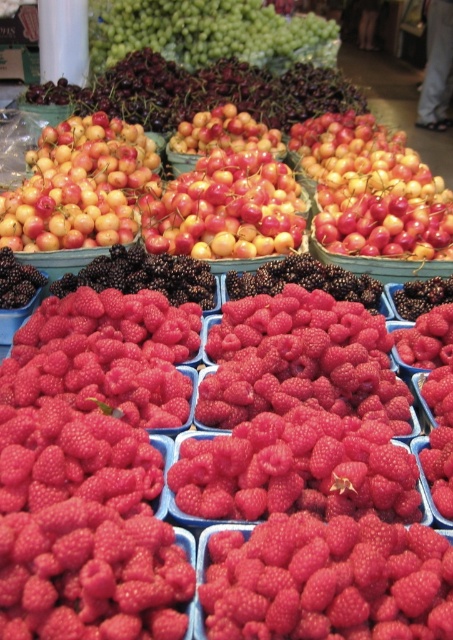
Question: Which point is farther to the camera?

Choices:
 (A) shiny black berries at center
 (B) black matte/blackberry at upper left
 (C) green matte grapes at upper center
 (D) bright red raspberry at center

Answer: (C)

Question: Is green matte grapes at upper center to the left of shiny black berries at center from the viewer's perspective?

Choices:
 (A) yes
 (B) no

Answer: (B)

Question: Is bright red raspberry at center below shiny black berries at center?

Choices:
 (A) no
 (B) yes

Answer: (B)

Question: Which point is farther to the camera?

Choices:
 (A) (78, 269)
 (B) (9, 212)

Answer: (B)

Question: Which object is closer to the camera taking this photo?

Choices:
 (A) shiny black berries at center
 (B) glossy red cherries at center
 (C) bright red raspberry at center
 (D) green matte grapes at upper center

Answer: (C)

Question: From the image, what is the correct spatial relationship of glossy yellow cherry at upper left in relation to green matte grapes at upper center?

Choices:
 (A) right
 (B) left

Answer: (B)